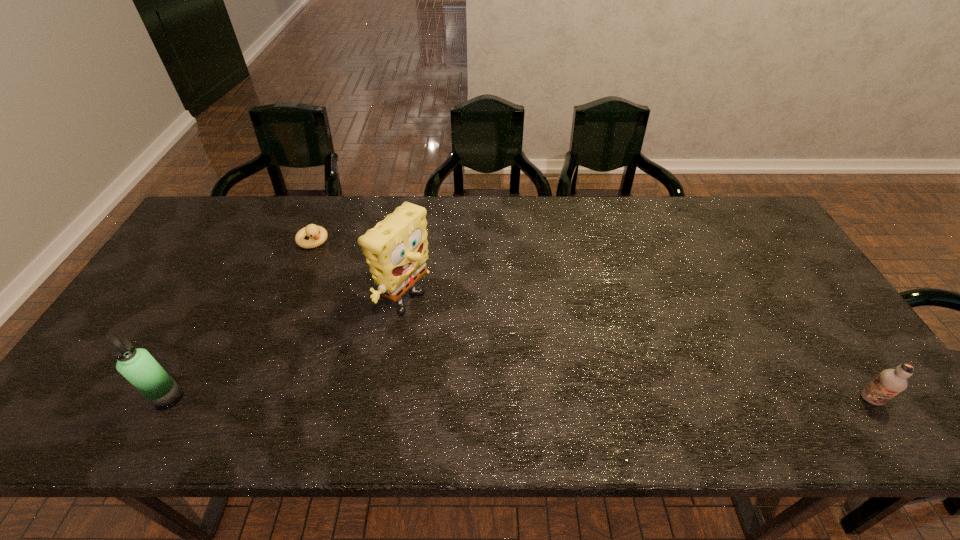
Find the location of a particular element. This screenshot has height=540, width=960. free location that satisfies the following two spatial constraints: 1. on the front side of the rightmost object; 2. on the right side of the third shortest object is located at coordinates (168, 400).

This screenshot has height=540, width=960. Identify the location of vacant region that satisfies the following two spatial constraints: 1. on the back side of the farthest object; 2. on the right side of the leftmost object. (253, 240).